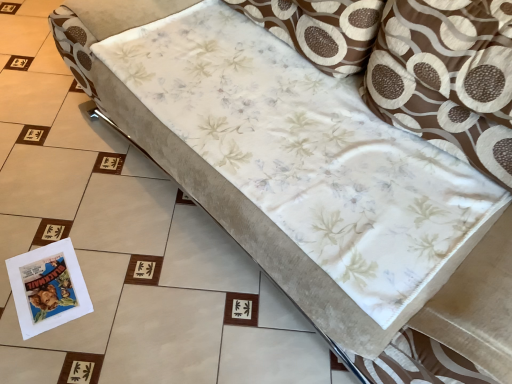
Question: Is brown textured pillow at upper right located within floral fabric pillow at upper right?

Choices:
 (A) yes
 (B) no

Answer: (B)

Question: Does floral fabric pillow at upper right appear on the left side of brown textured pillow at upper right?

Choices:
 (A) yes
 (B) no

Answer: (B)

Question: Can you confirm if floral fabric pillow at upper right is taller than brown textured pillow at upper right?

Choices:
 (A) yes
 (B) no

Answer: (A)

Question: Does floral fabric pillow at upper right have a smaller size compared to brown textured pillow at upper right?

Choices:
 (A) yes
 (B) no

Answer: (B)

Question: Is floral fabric pillow at upper right bigger than brown textured pillow at upper right?

Choices:
 (A) yes
 (B) no

Answer: (A)

Question: Is floral fabric pillow at upper right oriented away from brown textured pillow at upper right?

Choices:
 (A) yes
 (B) no

Answer: (B)

Question: Considering the relative positions of brown textured pillow at upper right and floral fabric pillow at upper right in the image provided, is brown textured pillow at upper right to the left of floral fabric pillow at upper right from the viewer's perspective?

Choices:
 (A) yes
 (B) no

Answer: (A)

Question: Does brown textured pillow at upper right have a greater height compared to floral fabric pillow at upper right?

Choices:
 (A) yes
 (B) no

Answer: (B)

Question: Considering the relative sizes of brown textured pillow at upper right and floral fabric pillow at upper right in the image provided, is brown textured pillow at upper right bigger than floral fabric pillow at upper right?

Choices:
 (A) no
 (B) yes

Answer: (A)

Question: Is brown textured pillow at upper right located outside floral fabric pillow at upper right?

Choices:
 (A) no
 (B) yes

Answer: (B)

Question: Does brown textured pillow at upper right touch floral fabric pillow at upper right?

Choices:
 (A) yes
 (B) no

Answer: (B)

Question: Is brown textured pillow at upper right facing away from floral fabric pillow at upper right?

Choices:
 (A) yes
 (B) no

Answer: (B)

Question: Is brown textured pillow at upper right in front of or behind floral fabric pillow at upper right in the image?

Choices:
 (A) behind
 (B) front

Answer: (A)